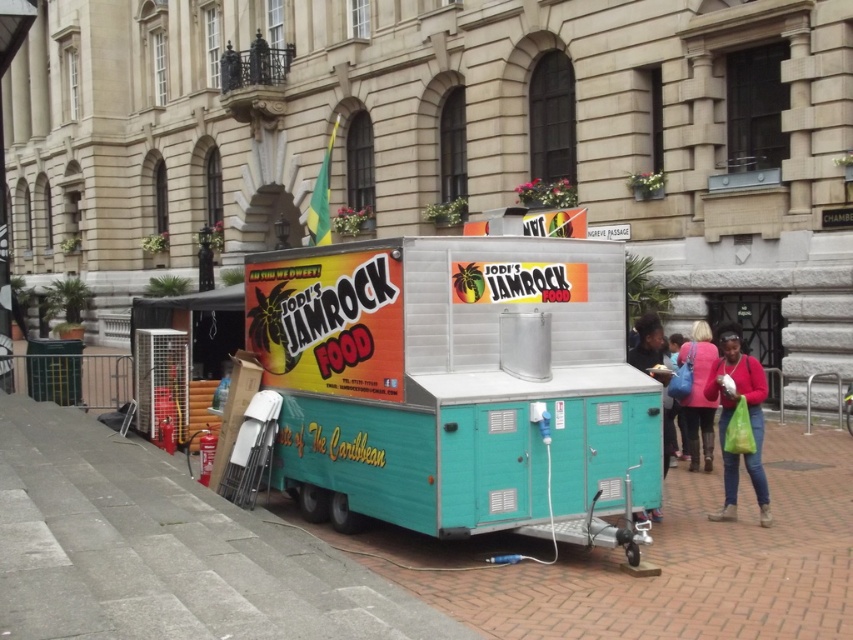
You are a customer standing in front of the teal matte food truck at center and the teal plastic food cart at right. Which one do you need to walk towards to order food first?

You should walk towards the teal matte food truck at center first because it is closer to you than the teal plastic food cart at right, so it is more accessible.

You are a customer waiting in line at the teal matte food truck at center and want to grab a chair from the teal plastic food cart at right. Can you walk directly between them to reach the chairs?

The teal matte food truck at center is to the left of the teal plastic food cart at right, so you can walk directly between them to reach the chairs.